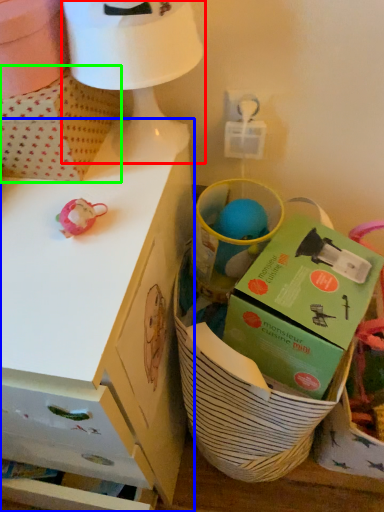
Question: Considering the real-world distances, which object is farthest from table lamp (highlighted by a red box)? desk (highlighted by a blue box) or cardboard box (highlighted by a green box)?

Choices:
 (A) desk
 (B) cardboard box

Answer: (A)